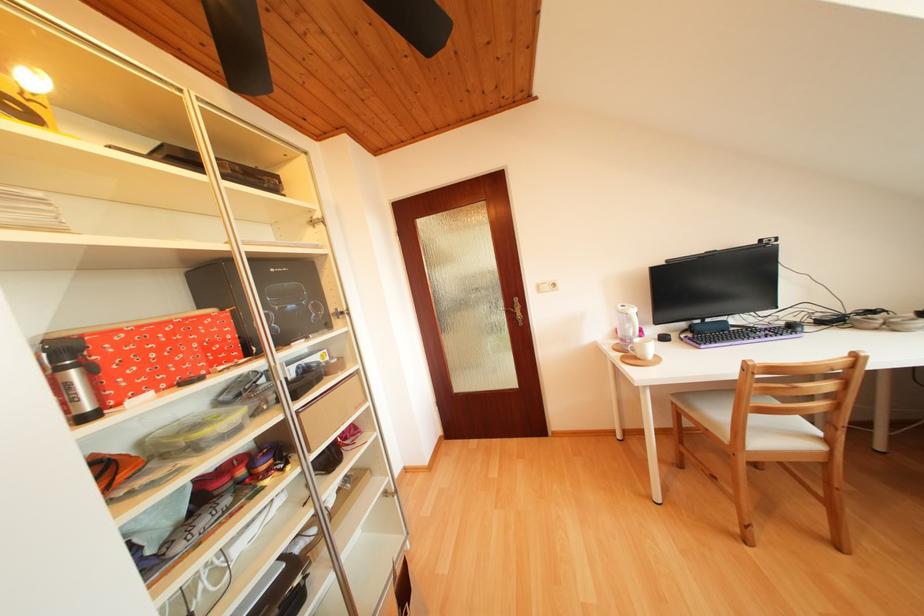
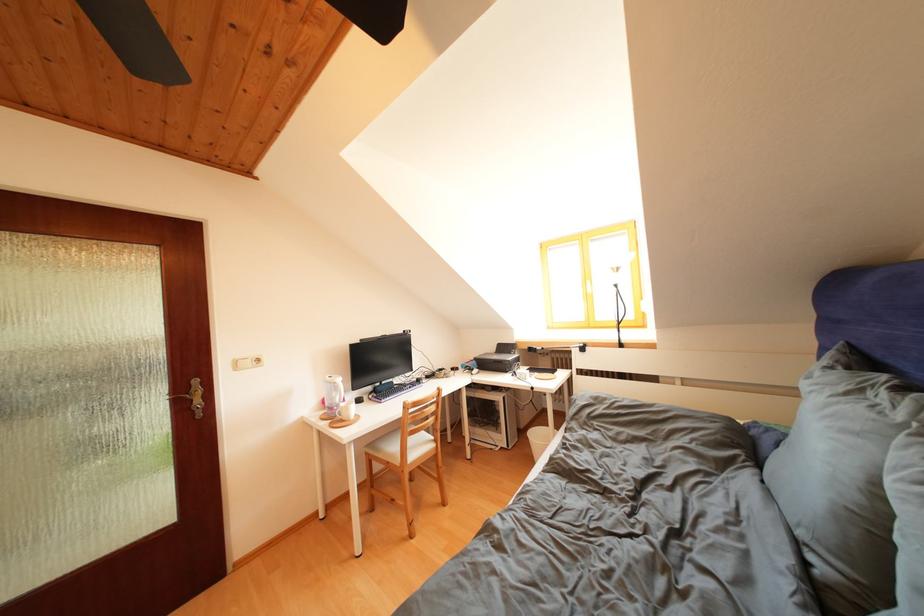
Locate, in the second image, the point that corresponds to point 523,305 in the first image.

(201, 387)